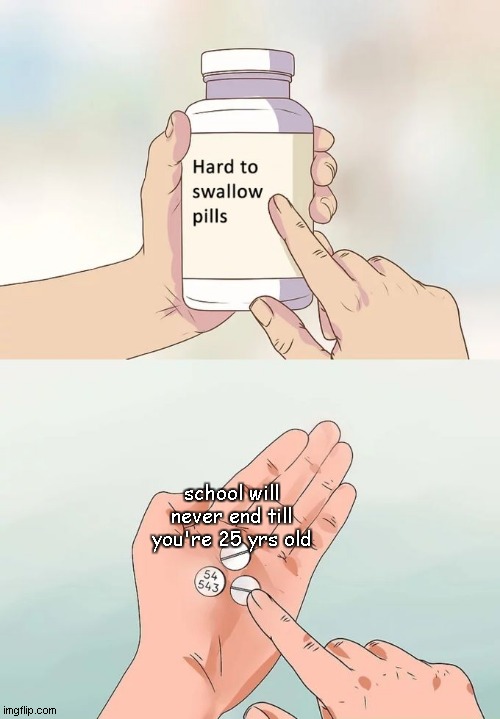
This screenshot has height=719, width=500. I want to click on pill bottle label, so click(x=231, y=262).